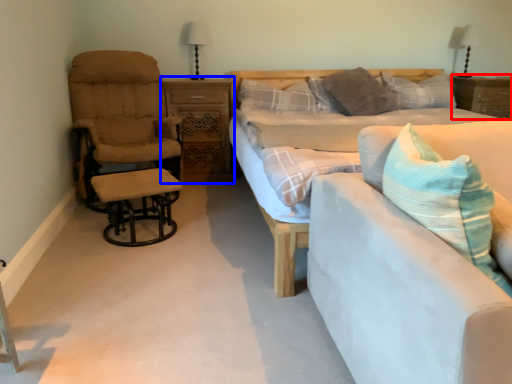
Question: Which object is closer to the camera taking this photo, nightstand (highlighted by a red box) or nightstand (highlighted by a blue box)?

Choices:
 (A) nightstand
 (B) nightstand

Answer: (B)